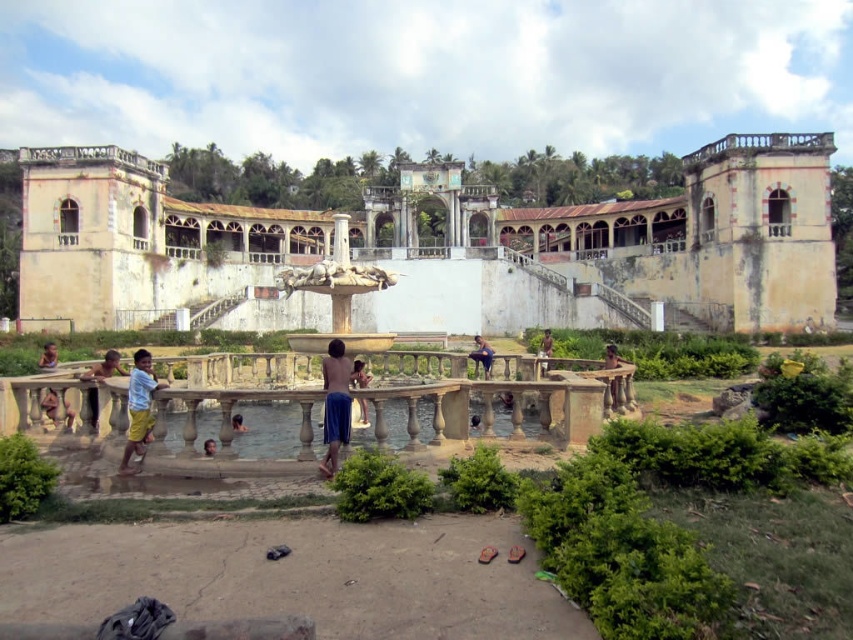
You are planning to build a small boat that is 1.5 meters wide. You want to sail it in the clear water at center where the brown skin person at center is standing. Can the boat fit in the water without touching the edges?

The clear water at center is wider than the brown skin person at center, but the exact width isn not provided. However, since the boat is 1.5 meters wide, and the water is wider than the person, it should have enough space to fit the boat without touching the edges.

You are standing in the scene and want to take a photo of the white weathered palace at center without including the light blue fabric shorts at lower left in the frame. Which direction should you move to achieve this?

Move to the left side of the light blue fabric shorts at lower left to position the white weathered palace at center out of the frame.